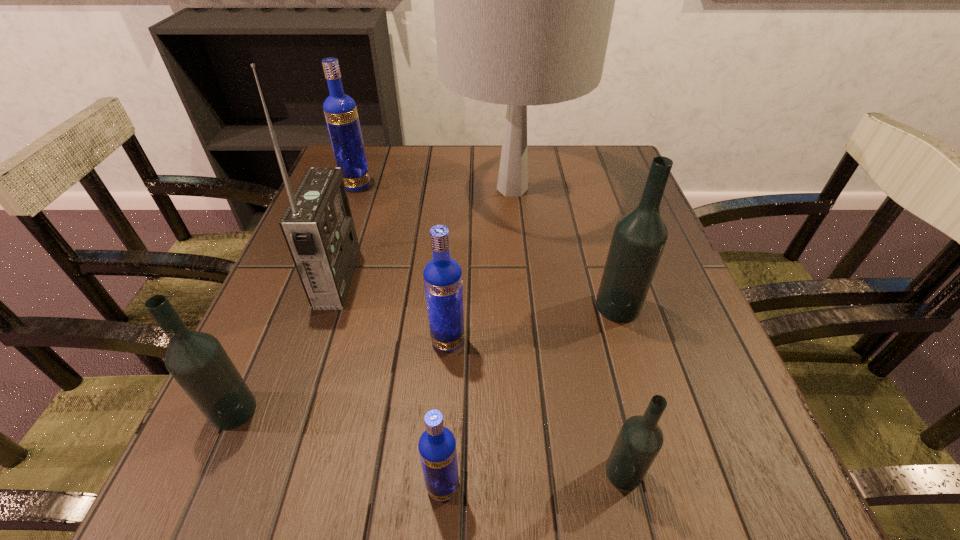
Image resolution: width=960 pixels, height=540 pixels. I want to click on the nearest blue vodka, so click(437, 447).

Identify the location of the nearest black vodka. Image resolution: width=960 pixels, height=540 pixels. (640, 439).

Where is `vacant space located on the front-facing side of the lampshade`? The image size is (960, 540). vacant space located on the front-facing side of the lampshade is located at coordinates (373, 189).

Find the location of a particular element. This screenshot has height=540, width=960. blank space located on the front-facing side of the lampshade is located at coordinates (341, 189).

You are a GUI agent. You are given a task and a screenshot of the screen. Output one action in this format:
    pyautogui.click(x=<x>, y=<y>)
    Task: Click on the vacant space located on the front-facing side of the lampshade
    
    Given the screenshot: What is the action you would take?
    pyautogui.click(x=385, y=189)

You are a GUI agent. You are given a task and a screenshot of the screen. Output one action in this format:
    pyautogui.click(x=<x>, y=<y>)
    Task: Click on the vacant space located on the display of the radio receiver
    
    Given the screenshot: What is the action you would take?
    pyautogui.click(x=511, y=278)

This screenshot has width=960, height=540. In order to click on free space located 0.380m on the right of the farthest vodka in this screenshot , I will do `click(521, 185)`.

Identify the location of vacant area situated 0.230m on the front of the fifth nearest vodka. The image size is (960, 540). (661, 449).

Locate an element on the screen. This screenshot has width=960, height=540. vacant position located 0.310m on the back of the third farthest vodka is located at coordinates (456, 222).

Where is `vacant space located 0.050m on the front of the second nearest black vodka`? vacant space located 0.050m on the front of the second nearest black vodka is located at coordinates (209, 465).